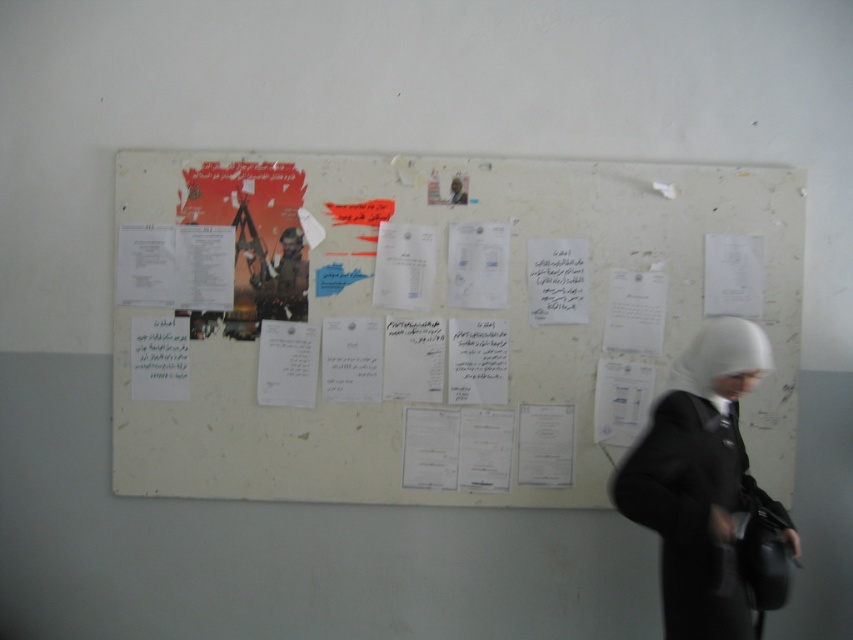
Does point (338, 436) come in front of point (263, 256)?

No, it is behind (263, 256).

Is white matte paper at center smaller than camouflage fabric soldier at center?

Actually, white matte paper at center might be larger than camouflage fabric soldier at center.

Is point (740, 204) positioned in front of point (300, 256)?

No, (740, 204) is behind (300, 256).

Find the location of a particular element. The image size is (853, 640). white matte paper at center is located at coordinates (434, 321).

Is point (651, 513) more distant than point (300, 275)?

No, (651, 513) is in front of (300, 275).

How much distance is there between white matte hijab at center and camouflage fabric soldier at center?

white matte hijab at center and camouflage fabric soldier at center are 1.26 meters apart.

Which is in front, point (635, 499) or point (250, 260)?

Point (635, 499)

The width and height of the screenshot is (853, 640). Find the location of `white matte hijab at center`. white matte hijab at center is located at coordinates (701, 483).

Which is behind, point (416, 468) or point (683, 576)?

Point (416, 468)

Who is more forward, (x=643, y=340) or (x=746, y=604)?

Point (x=746, y=604) is more forward.

You are a GUI agent. You are given a task and a screenshot of the screen. Output one action in this format:
    pyautogui.click(x=<x>, y=<y>)
    Task: Click on the white matte paper at center
    The width and height of the screenshot is (853, 640).
    Given the screenshot: What is the action you would take?
    (x=434, y=321)